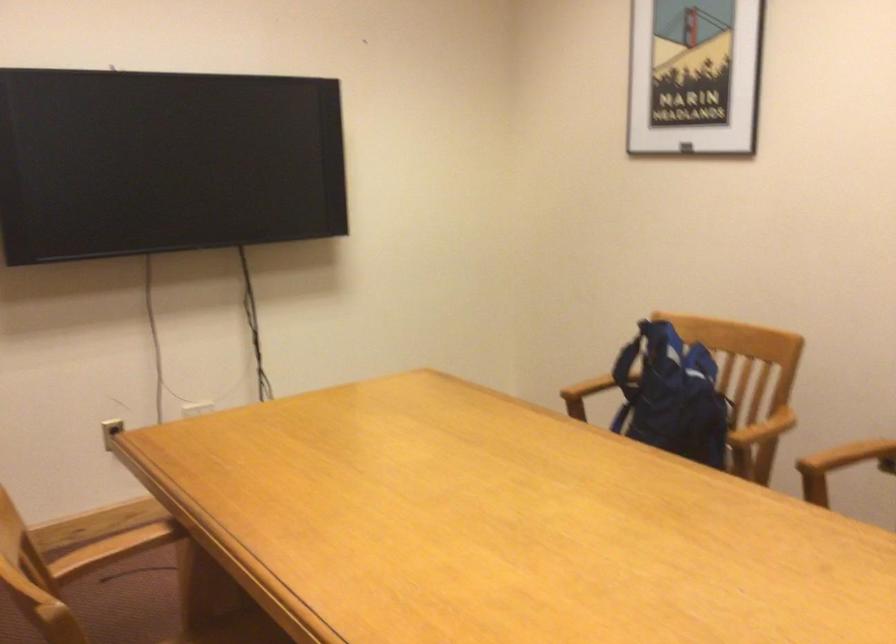
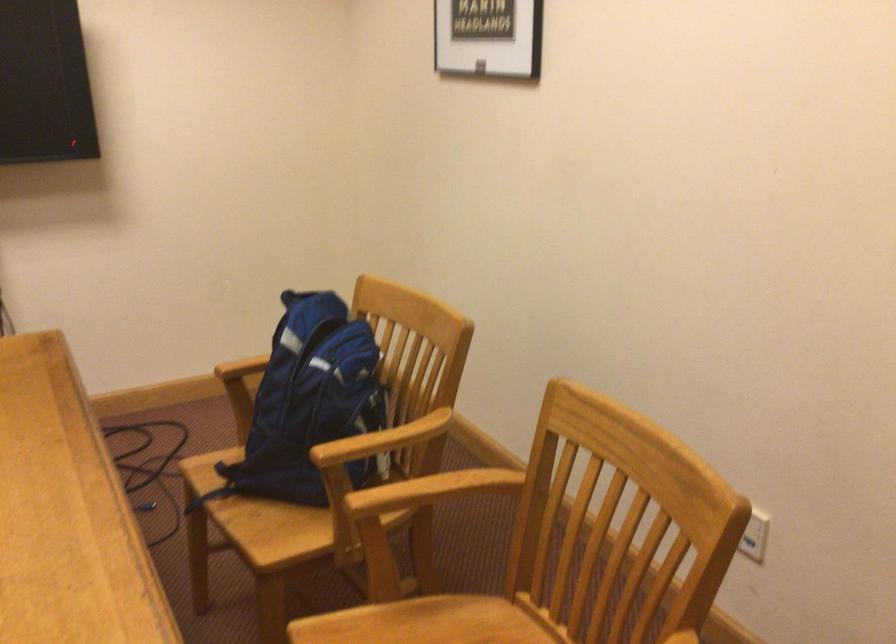
Question: I am providing you with two images of the same scene from different viewpoints. Which of the following objects are not visible in image2?

Choices:
 (A) blue backpack
 (B) wooden chair armrest
 (C) translucent plastic jug
 (D) chair sitting surface

Answer: (B)